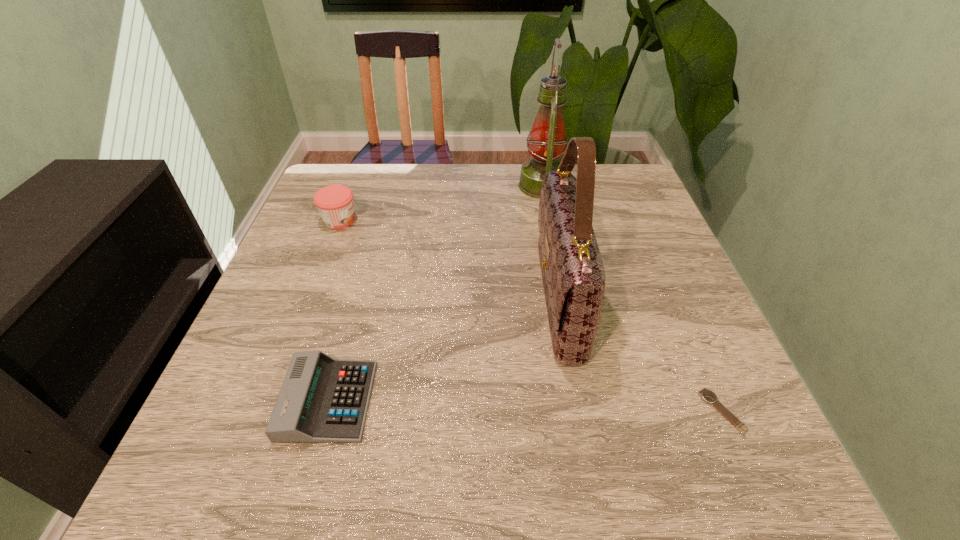
At what (x,y) coordinates should I click in order to perform the action: click on free spot between the third shortest object and the handbag. Please return your answer as a coordinate pair (x, y). Image resolution: width=960 pixels, height=540 pixels. Looking at the image, I should click on (x=449, y=260).

Where is `vacant area that lies between the farthest object and the second shortest object`? Image resolution: width=960 pixels, height=540 pixels. vacant area that lies between the farthest object and the second shortest object is located at coordinates (435, 293).

The width and height of the screenshot is (960, 540). Find the location of `free space between the rightmost object and the fourth tallest object`. free space between the rightmost object and the fourth tallest object is located at coordinates (525, 406).

Image resolution: width=960 pixels, height=540 pixels. In order to click on empty location between the shortest object and the second shortest object in this screenshot , I will do `click(525, 406)`.

The image size is (960, 540). What are the coordinates of `free area in between the third tallest object and the second shortest object` in the screenshot? It's located at (334, 310).

Find the location of a particular element. empty space that is in between the third tallest object and the handbag is located at coordinates (449, 260).

Locate which object is the second closest to the second shortest object. Please provide its 2D coordinates. Your answer should be formatted as a tuple, i.e. [(x, y)], where the tuple contains the x and y coordinates of a point satisfying the conditions above.

[(335, 204)]

The height and width of the screenshot is (540, 960). I want to click on the fourth closest object to the fourth nearest object, so click(707, 395).

Identify the location of free point that satisfies the following two spatial constraints: 1. on the front of the shortest object with the clasp; 2. on the right side of the handbag. (578, 411).

Locate an element on the screen. vacant space that satisfies the following two spatial constraints: 1. on the front side of the oil lamp; 2. on the front of the handbag with the clasp is located at coordinates (563, 299).